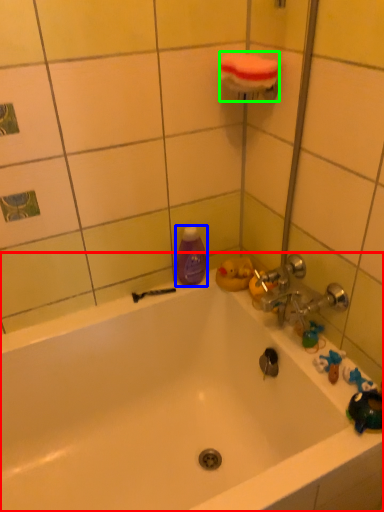
Question: Considering the real-world distances, which object is farthest from bathtub (highlighted by a red box)? cleaning product (highlighted by a blue box) or towel bar (highlighted by a green box)?

Choices:
 (A) cleaning product
 (B) towel bar

Answer: (B)